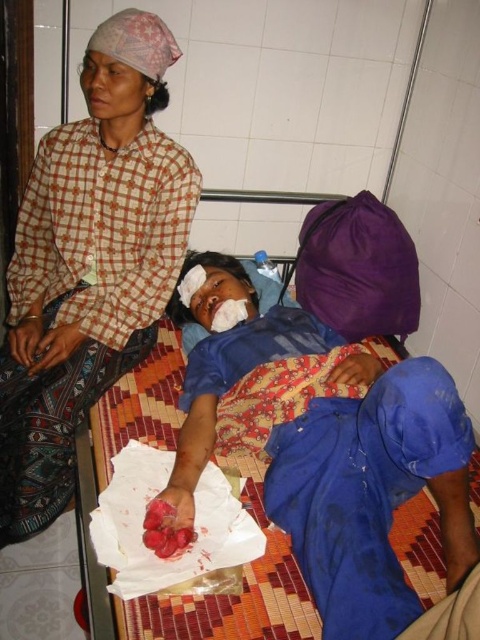
Question: Which point appears farthest from the camera in this image?

Choices:
 (A) pyautogui.click(x=36, y=312)
 (B) pyautogui.click(x=245, y=410)

Answer: (A)

Question: Is blue fabric bandage at center bigger than checkered fabric headscarf at upper left?

Choices:
 (A) yes
 (B) no

Answer: (A)

Question: Which of the following is the farthest from the observer?

Choices:
 (A) blue fabric bandage at center
 (B) checkered fabric headscarf at upper left

Answer: (B)

Question: Does blue fabric bandage at center have a greater width compared to checkered fabric headscarf at upper left?

Choices:
 (A) yes
 (B) no

Answer: (A)

Question: Is blue fabric bandage at center below checkered fabric headscarf at upper left?

Choices:
 (A) no
 (B) yes

Answer: (B)

Question: Which of the following is the closest to the observer?

Choices:
 (A) checkered fabric headscarf at upper left
 (B) blue fabric bandage at center

Answer: (B)